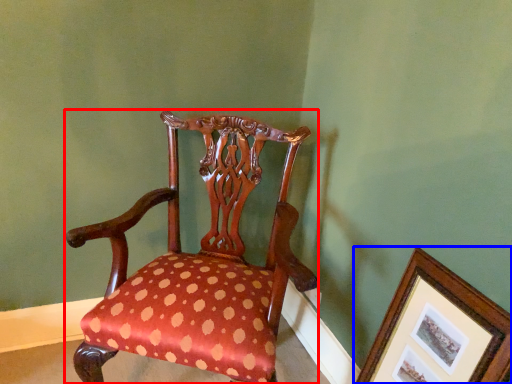
Question: Which point is further to the camera, chair (highlighted by a red box) or picture frame (highlighted by a blue box)?

Choices:
 (A) chair
 (B) picture frame

Answer: (A)